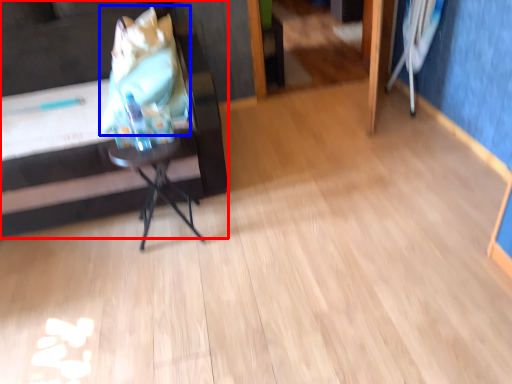
Question: Which point is closer to the camera, furniture (highlighted by a red box) or grocery bag (highlighted by a blue box)?

Choices:
 (A) furniture
 (B) grocery bag

Answer: (A)